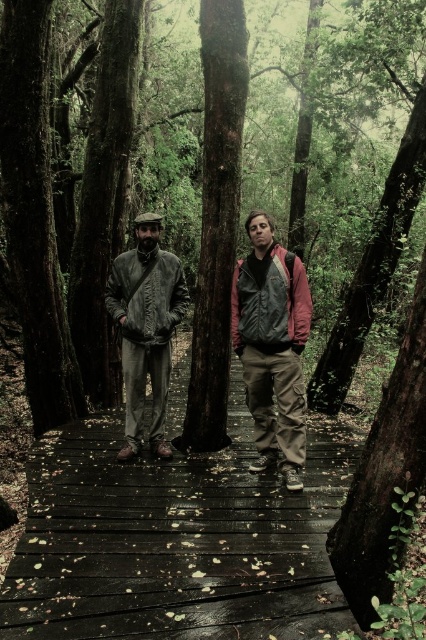
Looking at this image, you are a hiker trying to take a photo of the matte black jacket at center while avoiding the smooth brown tree trunk at center. Based on their positions, which direction should you move to ensure the tree trunk doesn not block the jacket in the photo?

The smooth brown tree trunk at center is positioned on the left side of matte black jacket at center. To avoid blocking the jacket with the tree trunk, move to the right side of the jacket so the tree trunk is out of frame to the left.

You are a hiker standing on the boardwalk and want to touch both the smooth brown tree trunk at center and the matte black jacket at center. Which object should you reach for first to touch the closer one?

You should reach for the smooth brown tree trunk at center first because it is closer to you than the matte black jacket at center.